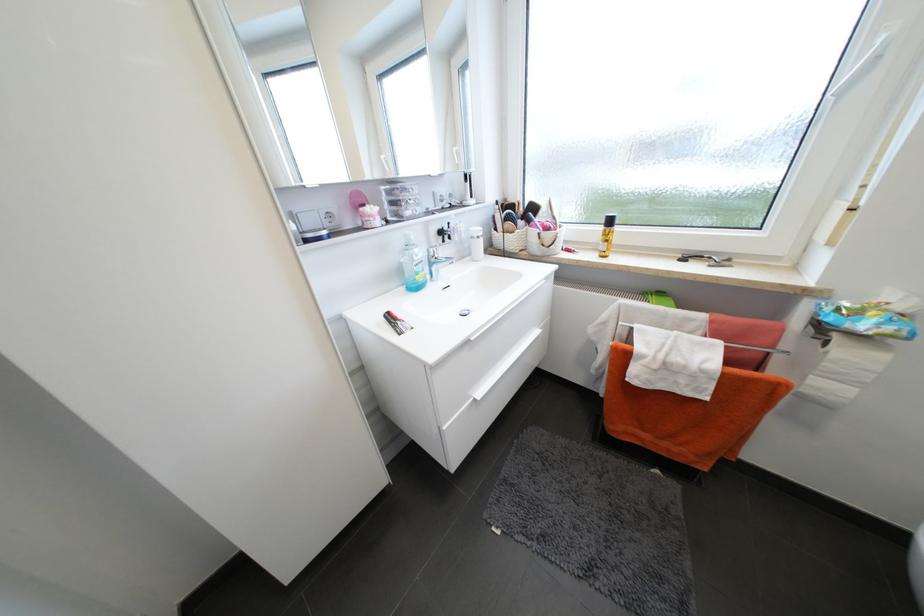
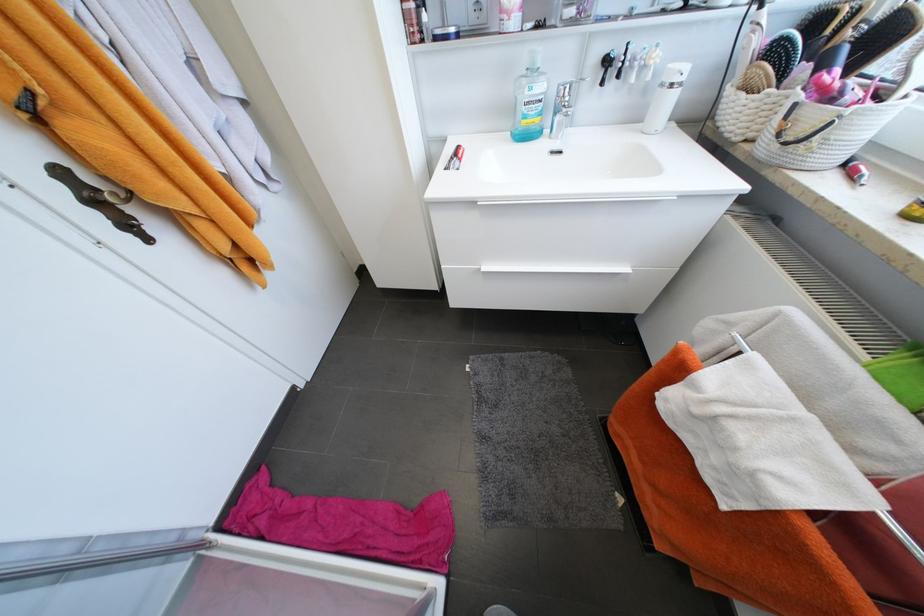
The first image is from the beginning of the video and the second image is from the end. How did the camera likely rotate when shooting the video?

The rotation direction of the camera is left-down.